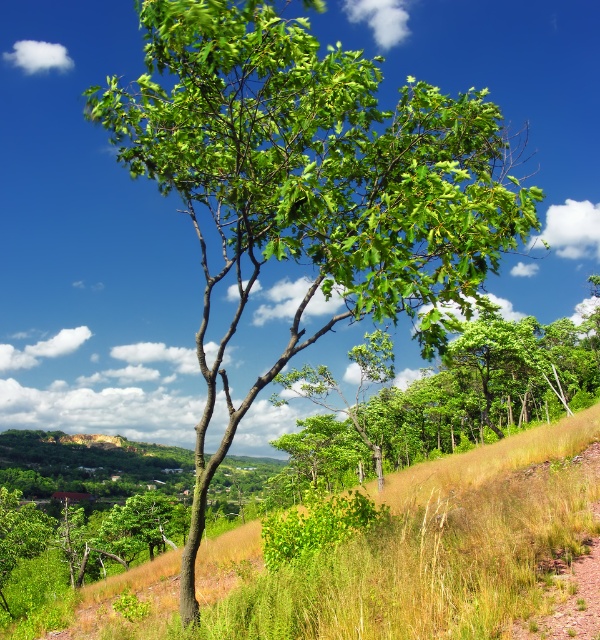
Question: Can you confirm if grassy hillside at center is bigger than green leafy tree at center?

Choices:
 (A) no
 (B) yes

Answer: (A)

Question: Does grassy hillside at center appear on the right side of green leafy tree at center?

Choices:
 (A) yes
 (B) no

Answer: (B)

Question: Does grassy hillside at center have a lesser width compared to green leafy tree at center?

Choices:
 (A) yes
 (B) no

Answer: (A)

Question: Which object appears closest to the camera in this image?

Choices:
 (A) green leafy tree at center
 (B) grassy hillside at center

Answer: (B)